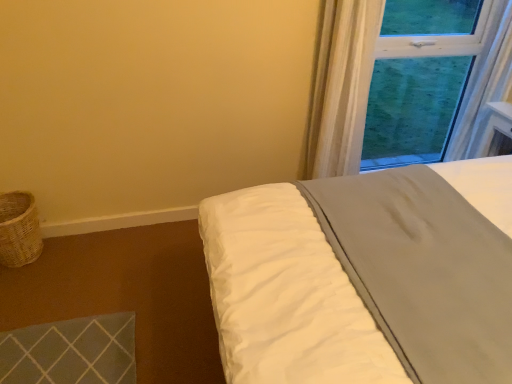
Question: Is white sheer curtain at upper right taller than white soft bed at upper right?

Choices:
 (A) no
 (B) yes

Answer: (B)

Question: Is white sheer curtain at upper right shorter than white soft bed at upper right?

Choices:
 (A) yes
 (B) no

Answer: (B)

Question: From a real-world perspective, does white sheer curtain at upper right stand above white soft bed at upper right?

Choices:
 (A) no
 (B) yes

Answer: (B)

Question: Does white sheer curtain at upper right have a larger size compared to white soft bed at upper right?

Choices:
 (A) yes
 (B) no

Answer: (B)

Question: Can you confirm if white sheer curtain at upper right is positioned to the left of white soft bed at upper right?

Choices:
 (A) yes
 (B) no

Answer: (A)

Question: Can you confirm if white sheer curtain at upper right is positioned to the right of white soft bed at upper right?

Choices:
 (A) yes
 (B) no

Answer: (B)

Question: Is woven wicker basket at lower left touching white soft bed at upper right?

Choices:
 (A) no
 (B) yes

Answer: (A)

Question: From the image's perspective, is woven wicker basket at lower left above white soft bed at upper right?

Choices:
 (A) no
 (B) yes

Answer: (B)

Question: Is white soft bed at upper right at the back of woven wicker basket at lower left?

Choices:
 (A) yes
 (B) no

Answer: (B)

Question: Is woven wicker basket at lower left facing towards white soft bed at upper right?

Choices:
 (A) yes
 (B) no

Answer: (B)

Question: Considering the relative sizes of woven wicker basket at lower left and white soft bed at upper right in the image provided, is woven wicker basket at lower left thinner than white soft bed at upper right?

Choices:
 (A) yes
 (B) no

Answer: (A)

Question: Would you say woven wicker basket at lower left is a long distance from white soft bed at upper right?

Choices:
 (A) yes
 (B) no

Answer: (A)

Question: Are woven wicker basket at lower left and white sheer curtain at upper right far apart?

Choices:
 (A) yes
 (B) no

Answer: (A)